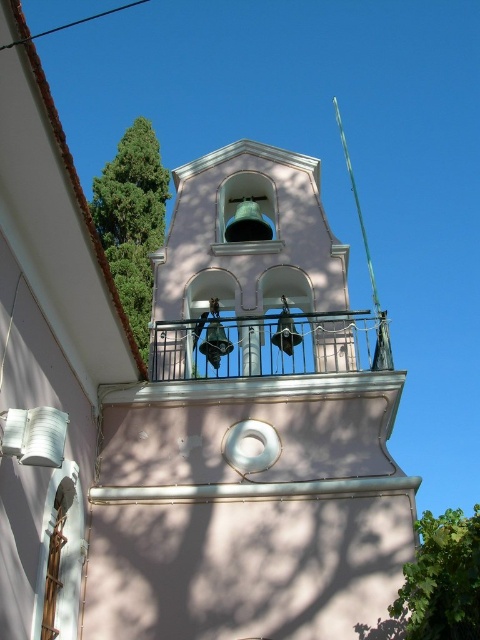
Is pink matte bell tower at center further to the viewer compared to green leafy tree at lower right?

Yes, it is.

Can you confirm if pink matte bell tower at center is positioned above green leafy tree at lower right?

Yes.

Who is more forward, (319, 300) or (460, 611)?

Positioned in front is point (460, 611).

This screenshot has width=480, height=640. Identify the location of pink matte bell tower at center. (247, 262).

Who is higher up, metallic silver balcony at center or green leafy tree at lower right?

metallic silver balcony at center is higher up.

Who is more distant from viewer, [235,353] or [471,564]?

The point [235,353] is more distant.

Who is more forward, (350, 317) or (441, 548)?

Point (441, 548)

Locate an element on the screen. metallic silver balcony at center is located at coordinates (269, 344).

Is pink matte bell tower at center bigger than green leafy tree at upper left?

Actually, pink matte bell tower at center might be smaller than green leafy tree at upper left.

Is point (299, 257) positioned before point (110, 193)?

Yes, point (299, 257) is closer to viewer.

Is point (212, 164) less distant than point (140, 148)?

Yes, it is in front of point (140, 148).

Image resolution: width=480 pixels, height=640 pixels. I want to click on pink matte bell tower at center, so click(247, 262).